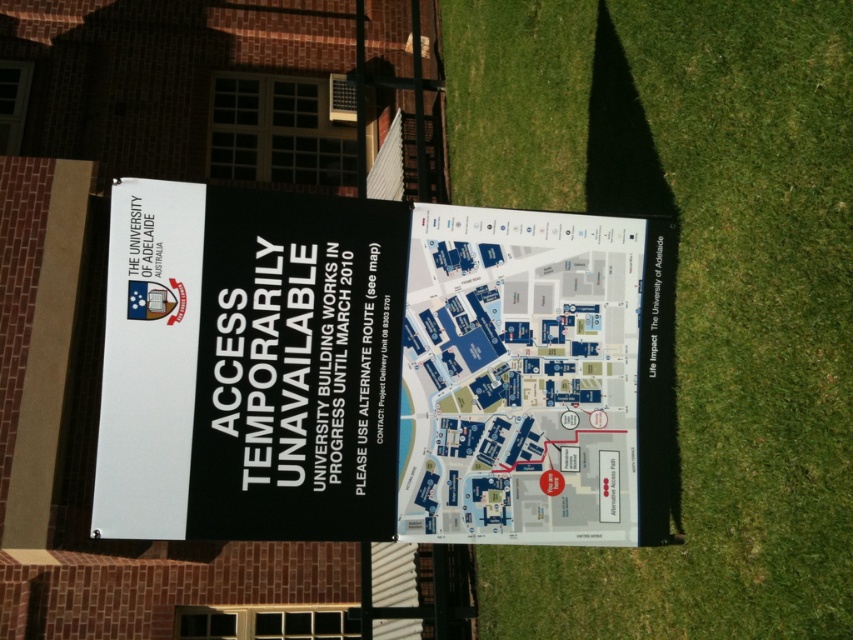
Measure the distance from green grass at lower right to black paper sign at upper left.

A distance of 2.45 meters exists between green grass at lower right and black paper sign at upper left.

Where is `green grass at lower right`? Image resolution: width=853 pixels, height=640 pixels. green grass at lower right is located at coordinates pos(691,289).

The height and width of the screenshot is (640, 853). Describe the element at coordinates (691, 289) in the screenshot. I see `green grass at lower right` at that location.

In order to click on green grass at lower right in this screenshot , I will do `click(691, 289)`.

Is green grass at lower right thinner than blue paper map at center?

Indeed, green grass at lower right has a lesser width compared to blue paper map at center.

Which of these two, green grass at lower right or blue paper map at center, stands taller?

blue paper map at center

In order to click on green grass at lower right in this screenshot , I will do `click(691, 289)`.

Identify the location of green grass at lower right. (691, 289).

Is point (167, 476) positioned behind point (506, 349)?

No, (167, 476) is in front of (506, 349).

Can you confirm if black paper sign at upper left is positioned below blue paper map at center?

No.

The image size is (853, 640). What do you see at coordinates (248, 364) in the screenshot?
I see `black paper sign at upper left` at bounding box center [248, 364].

Identify the location of black paper sign at upper left. Image resolution: width=853 pixels, height=640 pixels. (248, 364).